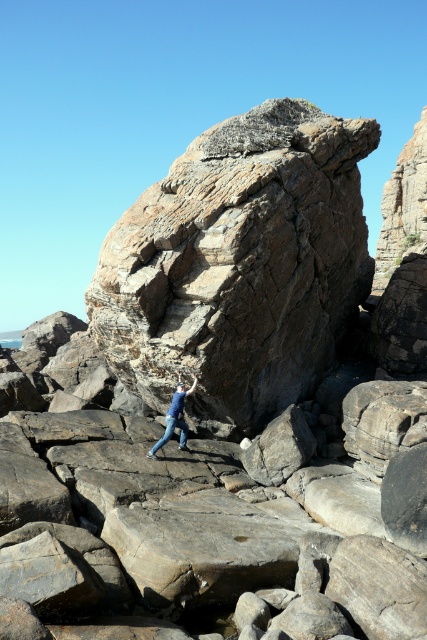
Can you confirm if rusty stone boulder at center is bigger than blue denim jeans at center?

Correct, rusty stone boulder at center is larger in size than blue denim jeans at center.

Is point (158, 218) less distant than point (169, 406)?

Yes, it is.

Which is behind, point (239, 259) or point (175, 388)?

The point (175, 388) is behind.

Image resolution: width=427 pixels, height=640 pixels. Find the location of `rusty stone boulder at center`. rusty stone boulder at center is located at coordinates (239, 264).